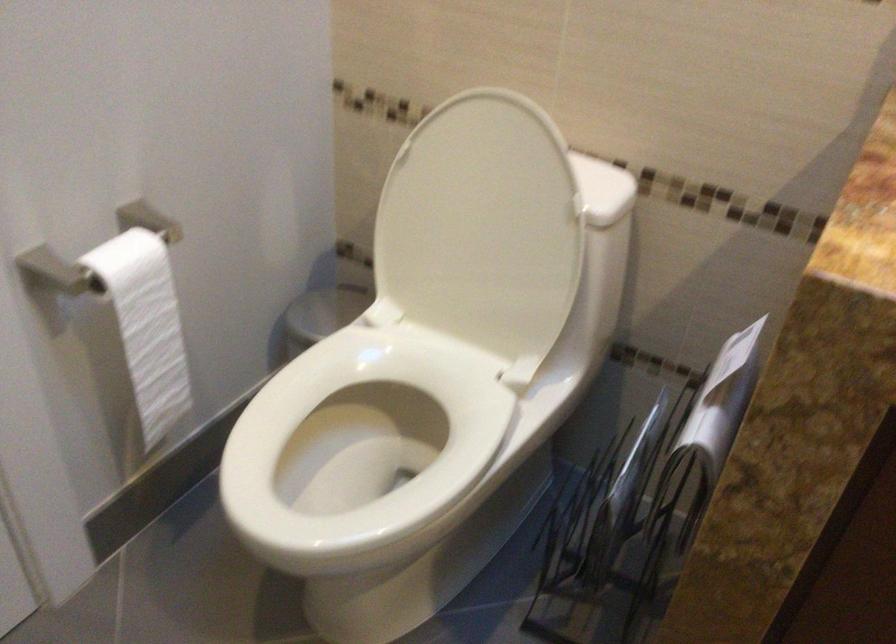
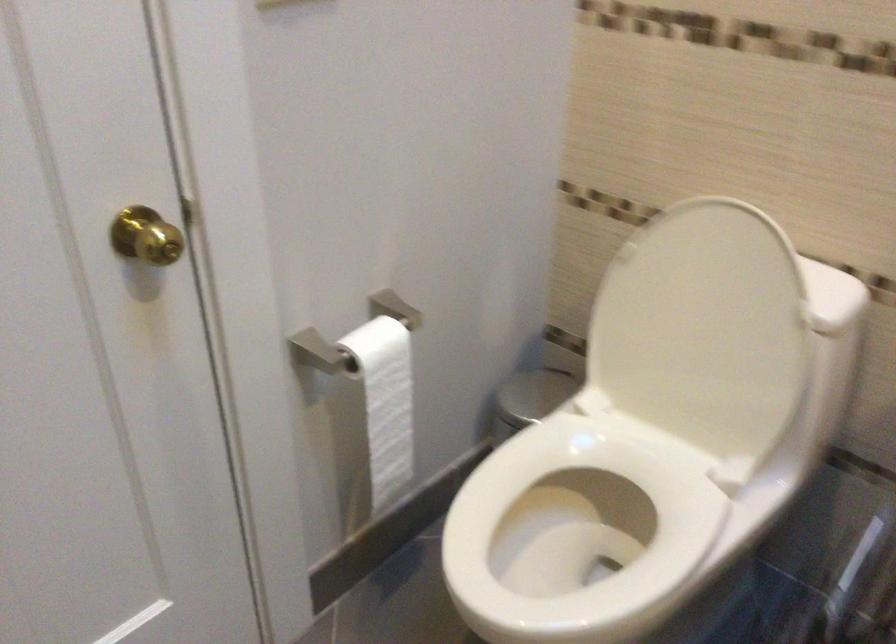
In the second image, find the point that corresponds to [144,327] in the first image.

(385, 402)